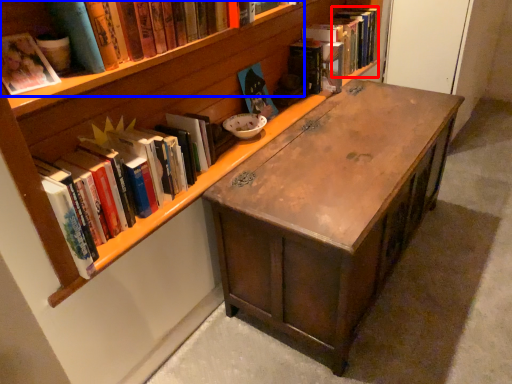
Question: Which object is further to the camera taking this photo, book (highlighted by a red box) or book (highlighted by a blue box)?

Choices:
 (A) book
 (B) book

Answer: (A)